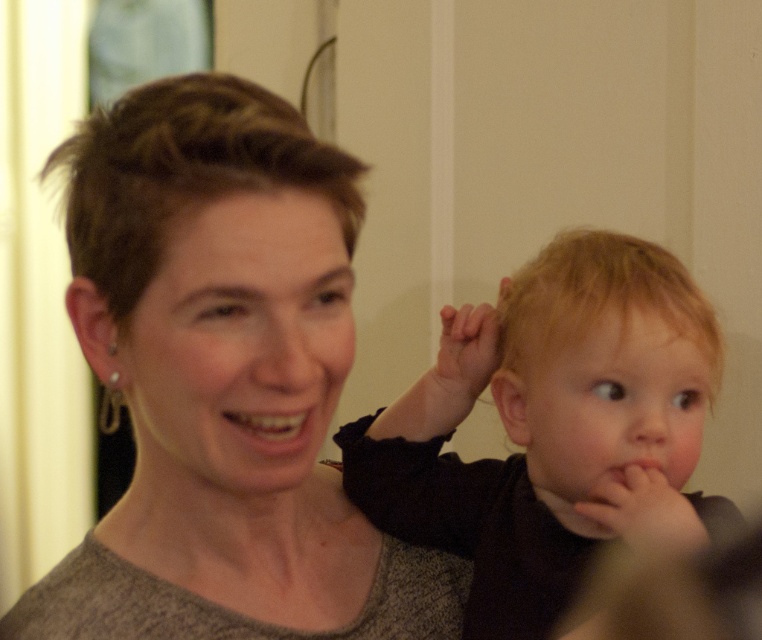
You are a photographer analyzing the composition of this image. The scene includes a woman on the left and a child on the right. There is a point at coordinates (223, 381). What object is located at this point?

The point at coordinates (223, 381) indicates the matte gray sweater at center.

You are taking a photo of two people in a room with a camera that has a depth sensor. The woman is at point (301, 577) and the child is at point (584, 266). Which point is closer to the camera?

Point (301, 577) is closer to the camera than point (584, 266).